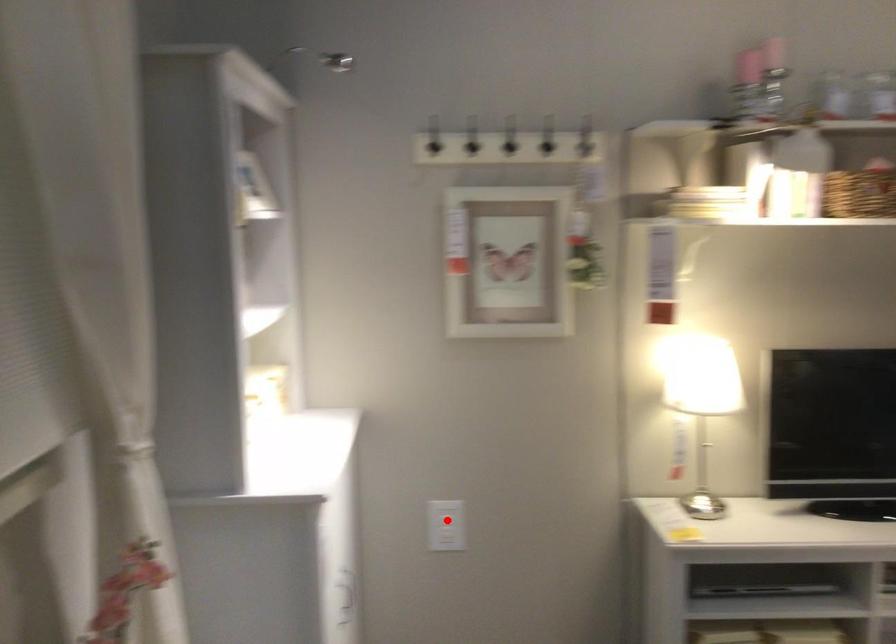
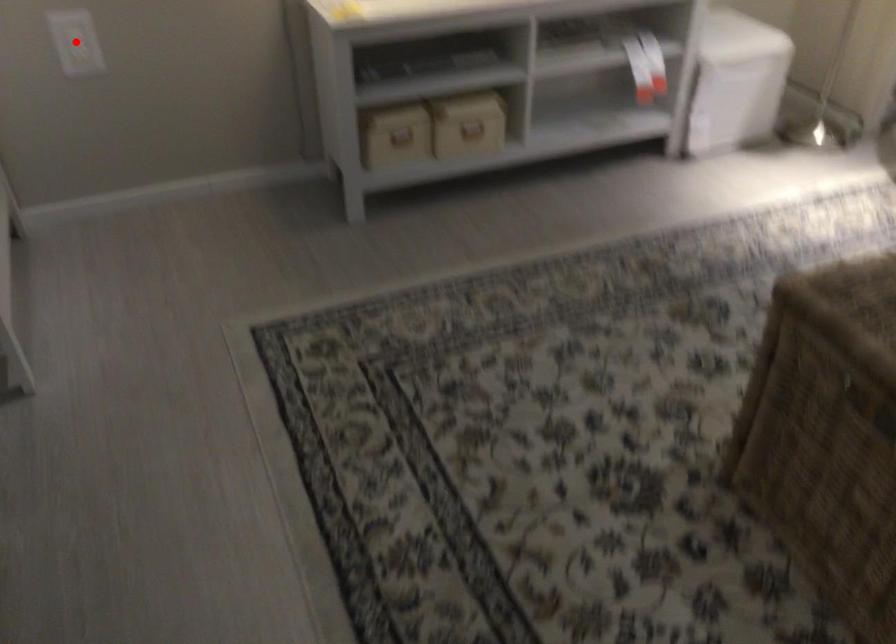
I am providing you with two images of the same scene from different viewpoints. A red point is marked on the first image and another point is marked on the second image. Do the highlighted points in image1 and image2 indicate the same real-world spot?

Yes